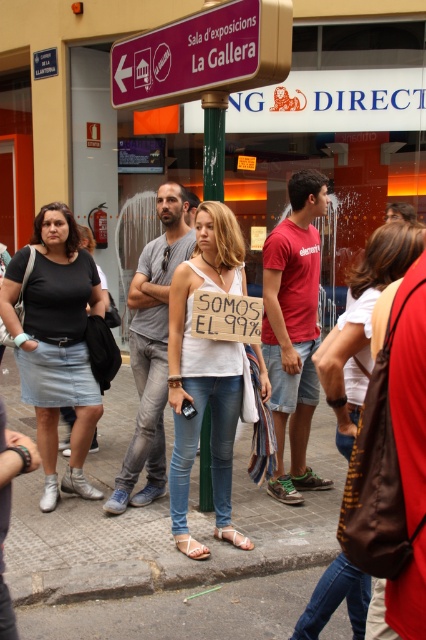
Who is higher up, denim skirt at left or red cotton t-shirt at center?

Positioned higher is red cotton t-shirt at center.

You are a GUI agent. You are given a task and a screenshot of the screen. Output one action in this format:
    pyautogui.click(x=<x>, y=<y>)
    Task: Click on the denim skirt at left
    This screenshot has width=426, height=640.
    Given the screenshot: What is the action you would take?
    pyautogui.click(x=55, y=342)

Identify the location of denim skirt at left. The width and height of the screenshot is (426, 640). (55, 342).

Who is positioned more to the left, white cotton tank top at center or denim jeans at center?

Positioned to the left is denim jeans at center.

This screenshot has width=426, height=640. Describe the element at coordinates (206, 374) in the screenshot. I see `white cotton tank top at center` at that location.

This screenshot has width=426, height=640. Identify the location of white cotton tank top at center. (206, 374).

Measure the distance between denim skirt at left and denim jeans at center.

denim skirt at left is 20.24 inches from denim jeans at center.

Consider the image. Who is more distant from viewer, (65,205) or (149,374)?

Point (149,374)

The image size is (426, 640). Identify the location of denim skirt at left. (55, 342).